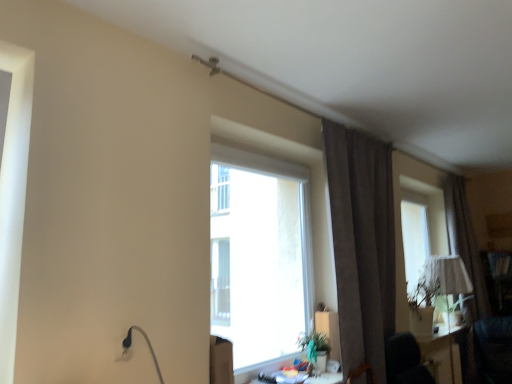
Question: Is brown fabric curtain at right, the first curtain when ordered from back to front, wider than transparent glass window at center?

Choices:
 (A) yes
 (B) no

Answer: (A)

Question: From a real-world perspective, is brown fabric curtain at right, the 1th curtain viewed from the right, beneath transparent glass window at center?

Choices:
 (A) no
 (B) yes

Answer: (B)

Question: Is the depth of brown fabric curtain at right, which is counted as the second curtain, starting from the left, less than that of transparent glass window at center?

Choices:
 (A) yes
 (B) no

Answer: (B)

Question: From the image's perspective, is brown fabric curtain at right, which is counted as the 2th curtain, starting from the front, on top of transparent glass window at center?

Choices:
 (A) yes
 (B) no

Answer: (B)

Question: Is brown fabric curtain at right, which is counted as the second curtain, starting from the left, outside transparent glass window at center?

Choices:
 (A) yes
 (B) no

Answer: (A)

Question: Looking at their shapes, would you say brown velvet curtain at upper right, which is the 1th curtain from front to back, is wider or thinner than brown fabric curtain at right, the first curtain when ordered from back to front?

Choices:
 (A) thin
 (B) wide

Answer: (B)

Question: Considering the positions of brown velvet curtain at upper right, which is the 1th curtain from front to back, and brown fabric curtain at right, which is counted as the second curtain, starting from the left, in the image, is brown velvet curtain at upper right, which is the 1th curtain from front to back, taller or shorter than brown fabric curtain at right, which is counted as the second curtain, starting from the left,?

Choices:
 (A) tall
 (B) short

Answer: (B)

Question: Is brown velvet curtain at upper right, which is the 1th curtain from front to back, in front of or behind brown fabric curtain at right, the 1th curtain viewed from the right, in the image?

Choices:
 (A) behind
 (B) front

Answer: (B)

Question: Does point (355, 150) appear closer or farther from the camera than point (479, 304)?

Choices:
 (A) farther
 (B) closer

Answer: (B)

Question: From a real-world perspective, relative to wooden desk at lower center, which is the first table in top-to-bottom order, is matte white lampshade at right vertically above or below?

Choices:
 (A) below
 (B) above

Answer: (B)

Question: In terms of height, does matte white lampshade at right look taller or shorter compared to wooden desk at lower center, arranged as the first table when viewed from the front?

Choices:
 (A) short
 (B) tall

Answer: (B)

Question: Looking at their shapes, would you say matte white lampshade at right is wider or thinner than wooden desk at lower center, placed as the second table when sorted from right to left?

Choices:
 (A) thin
 (B) wide

Answer: (B)

Question: Does point (443, 256) appear closer or farther from the camera than point (288, 380)?

Choices:
 (A) closer
 (B) farther

Answer: (B)

Question: Does point 338,380 appear closer or farther from the camera than point 478,279?

Choices:
 (A) closer
 (B) farther

Answer: (A)

Question: Considering the positions of wooden desk at lower center, placed as the second table when sorted from right to left, and brown fabric curtain at right, the first curtain when ordered from back to front, in the image, is wooden desk at lower center, placed as the second table when sorted from right to left, bigger or smaller than brown fabric curtain at right, the first curtain when ordered from back to front,?

Choices:
 (A) big
 (B) small

Answer: (B)